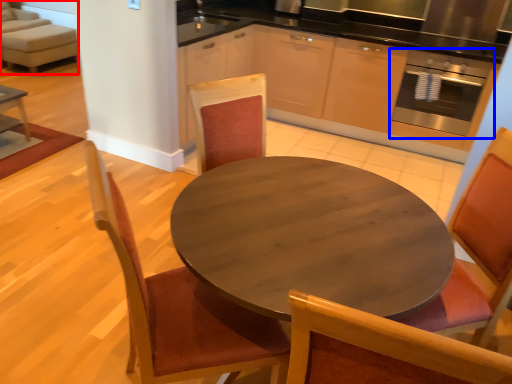
Question: Which object appears farthest to the camera in this image, couch (highlighted by a red box) or oven (highlighted by a blue box)?

Choices:
 (A) couch
 (B) oven

Answer: (A)